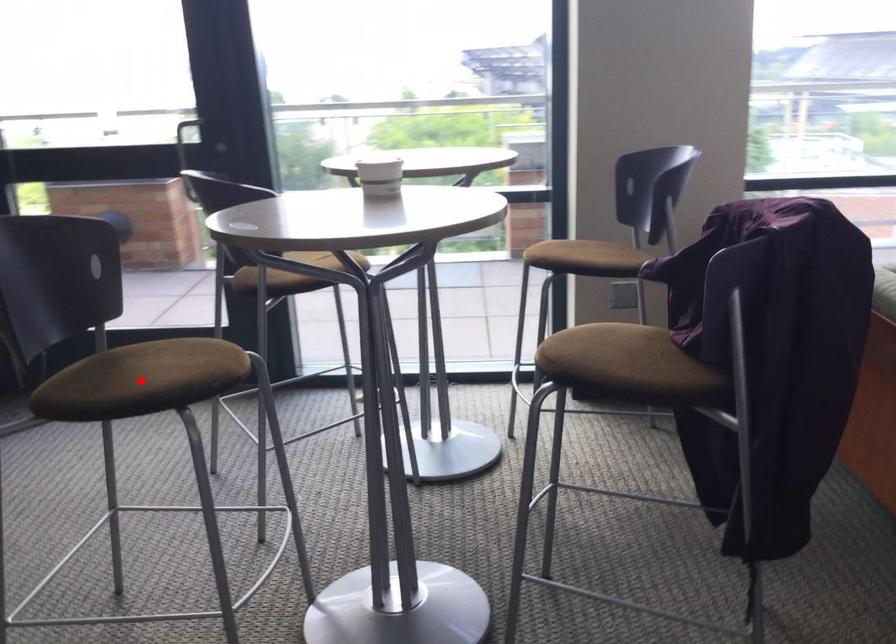
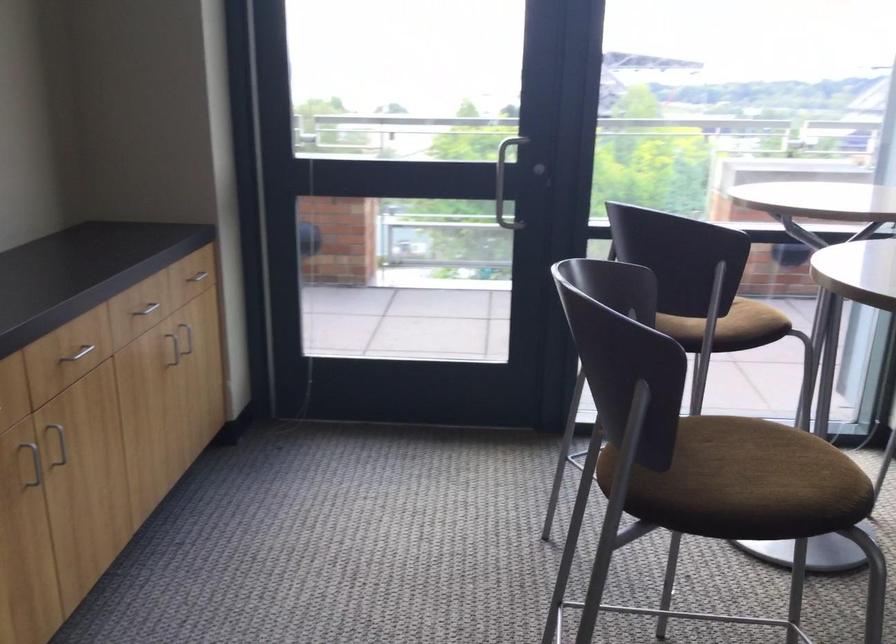
In the second image, find the point that corresponds to the highlighted location in the first image.

(739, 482)